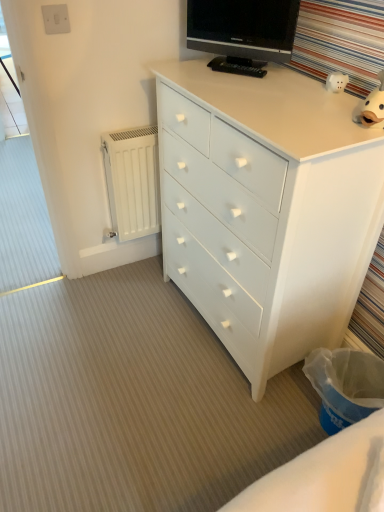
The width and height of the screenshot is (384, 512). Identify the location of vacant space positioned to the left of black glossy tv at upper center. (186, 70).